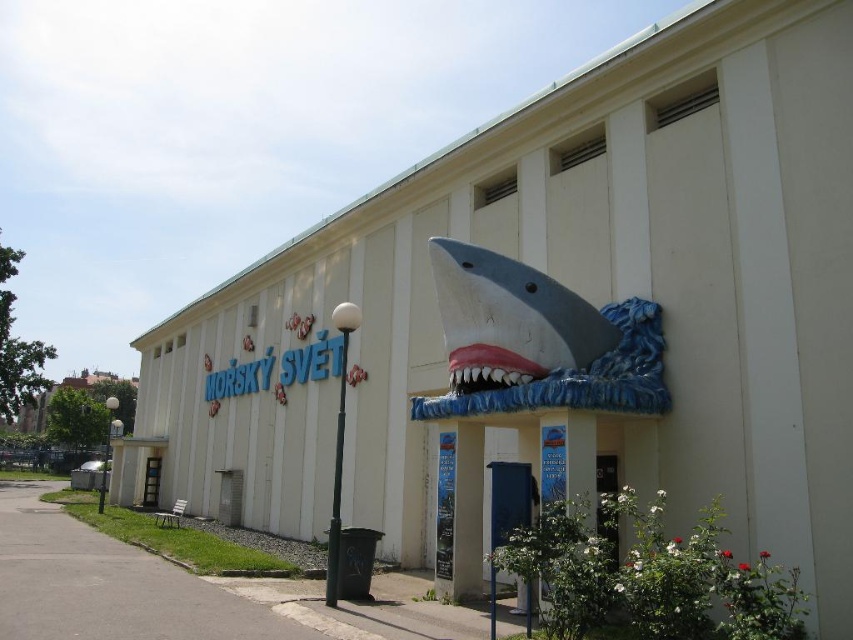
You are a visitor standing at the entrance of MORSKY SVET. You see the white matte shark at center and the pink glossy jaw at center. Which object is larger?

The white matte shark at center is bigger than the pink glossy jaw at center.

You are standing at the entrance of the building and want to take a photo of the white matte shark at center. Based on its position, which direction should you face to ensure it is centered in your camera view?

The white matte shark at center is located at point coordinates, so facing directly towards the entrance area where it is prominently displayed will center it in your camera view.

You are standing in front of the building and see the entrance marked. There is a point at coordinates point (509, 320). Where is this point located?

The point (509, 320) is on the white matte shark at center.